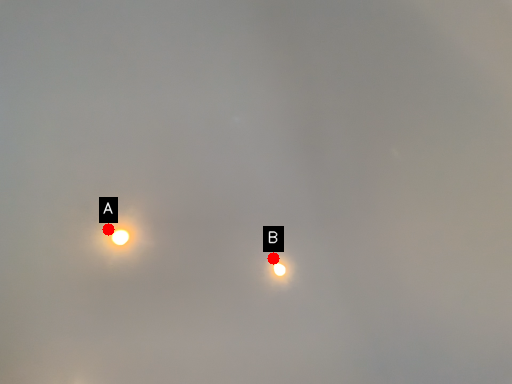
Question: Two points are circled on the image, labeled by A and B beside each circle. Which point is closer to the camera taking this photo?

Choices:
 (A) A is closer
 (B) B is closer

Answer: (A)